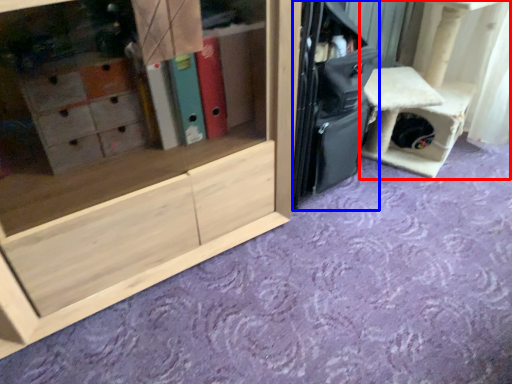
Question: Which of the following is the closest to the observer, furniture (highlighted by a red box) or luggage (highlighted by a blue box)?

Choices:
 (A) furniture
 (B) luggage

Answer: (B)